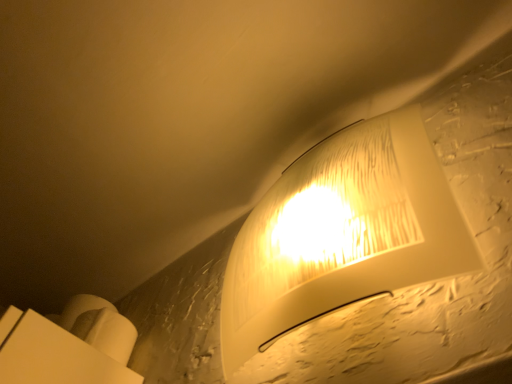
What do you see at coordinates (342, 233) in the screenshot? The width and height of the screenshot is (512, 384). I see `matte white lamp at upper right` at bounding box center [342, 233].

At what (x,y) coordinates should I click in order to perform the action: click on matte white lamp at upper right. Please return your answer as a coordinate pair (x, y). Image resolution: width=512 pixels, height=384 pixels. Looking at the image, I should click on (342, 233).

Identify the location of matte white lamp at upper right. (342, 233).